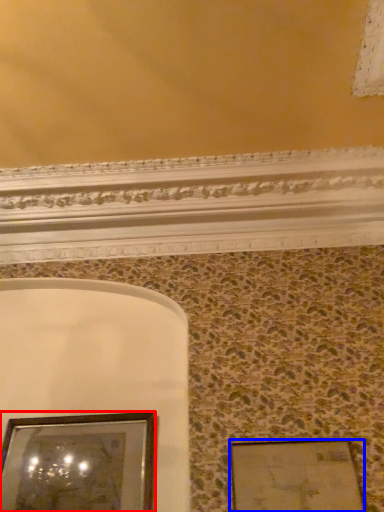
Question: Among these objects, which one is farthest to the camera, picture frame (highlighted by a red box) or picture frame (highlighted by a blue box)?

Choices:
 (A) picture frame
 (B) picture frame

Answer: (A)